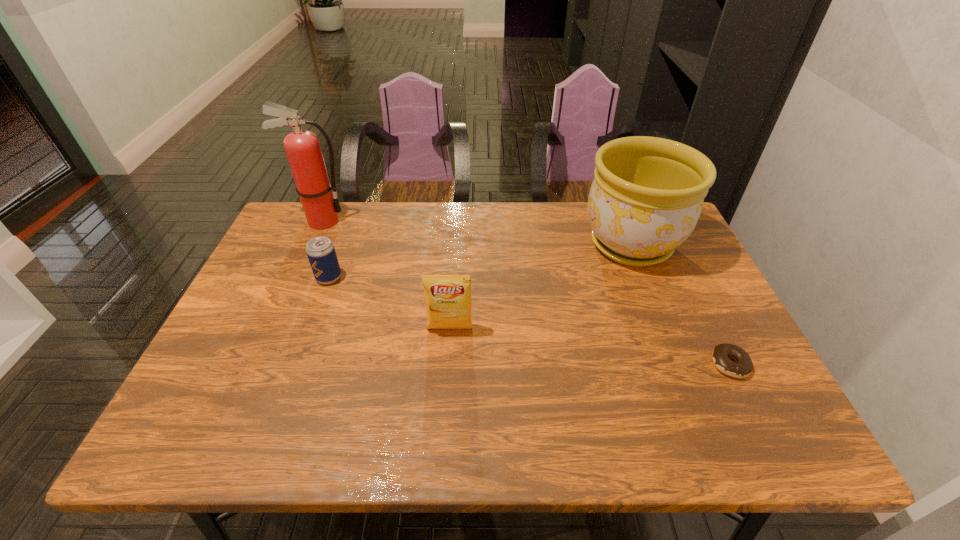
In the image, there is a desktop. Identify the location of vacant space at the near edge. (619, 433).

The width and height of the screenshot is (960, 540). In the image, there is a desktop. Find the location of `vacant space at the left edge`. vacant space at the left edge is located at coordinates (228, 326).

Image resolution: width=960 pixels, height=540 pixels. What are the coordinates of `blank space at the right edge of the desktop` in the screenshot? It's located at (690, 266).

The height and width of the screenshot is (540, 960). I want to click on vacant area that lies between the nearest object and the fire extinguisher, so click(x=526, y=293).

Where is `blank region between the fourth shortest object and the doughnut`? This screenshot has width=960, height=540. blank region between the fourth shortest object and the doughnut is located at coordinates [681, 304].

Find the location of a particular element. vacant area that lies between the beer can and the nearest object is located at coordinates (530, 321).

The height and width of the screenshot is (540, 960). I want to click on vacant space that's between the third object from left to right and the tallest object, so click(x=386, y=275).

Where is `free space that is in between the second shortest object and the nearest object`? This screenshot has height=540, width=960. free space that is in between the second shortest object and the nearest object is located at coordinates (530, 321).

The height and width of the screenshot is (540, 960). Find the location of `empty space that is in between the fire extinguisher and the second nearest object`. empty space that is in between the fire extinguisher and the second nearest object is located at coordinates (386, 275).

In order to click on empty space that is in between the second shortest object and the crisp (potato chip) in this screenshot , I will do `click(390, 303)`.